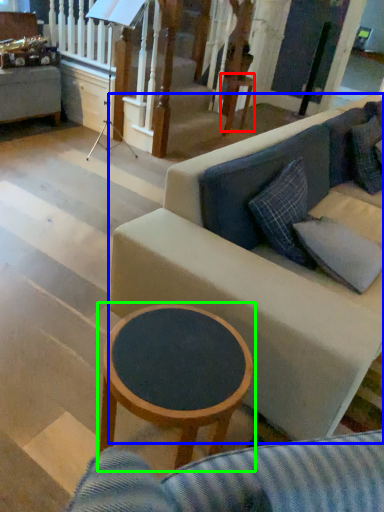
Question: Which object is positioned closest to table (highlighted by a red box)? Select from studio couch (highlighted by a blue box) and coffee table (highlighted by a green box).

Choices:
 (A) studio couch
 (B) coffee table

Answer: (A)